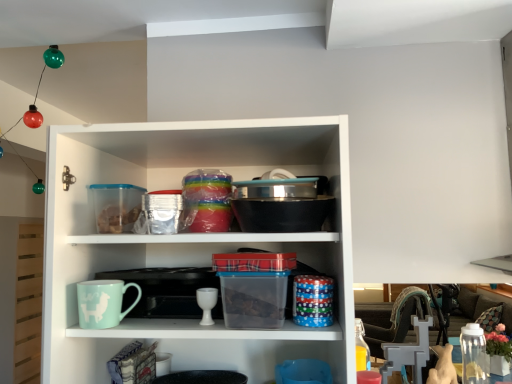
Question: Is the position of light blue ceramic mug at lower left less distant than that of clear plastic jar at lower right?

Choices:
 (A) yes
 (B) no

Answer: (A)

Question: Considering the relative sizes of light blue ceramic mug at lower left and clear plastic jar at lower right in the image provided, is light blue ceramic mug at lower left shorter than clear plastic jar at lower right?

Choices:
 (A) yes
 (B) no

Answer: (A)

Question: Is light blue ceramic mug at lower left at the left side of clear plastic jar at lower right?

Choices:
 (A) no
 (B) yes

Answer: (B)

Question: Considering the relative sizes of light blue ceramic mug at lower left and clear plastic jar at lower right in the image provided, is light blue ceramic mug at lower left wider than clear plastic jar at lower right?

Choices:
 (A) no
 (B) yes

Answer: (A)

Question: Would you consider light blue ceramic mug at lower left to be distant from clear plastic jar at lower right?

Choices:
 (A) no
 (B) yes

Answer: (B)

Question: Can you confirm if light blue ceramic mug at lower left is bigger than clear plastic jar at lower right?

Choices:
 (A) yes
 (B) no

Answer: (B)

Question: Is white glossy goblet at center positioned beyond the bounds of light blue ceramic mug at lower left?

Choices:
 (A) no
 (B) yes

Answer: (B)

Question: From a real-world perspective, is white glossy goblet at center physically above light blue ceramic mug at lower left?

Choices:
 (A) no
 (B) yes

Answer: (A)

Question: From the image's perspective, is white glossy goblet at center below light blue ceramic mug at lower left?

Choices:
 (A) yes
 (B) no

Answer: (A)

Question: Is white glossy goblet at center turned away from light blue ceramic mug at lower left?

Choices:
 (A) no
 (B) yes

Answer: (A)

Question: Could you tell me if white glossy goblet at center is turned towards light blue ceramic mug at lower left?

Choices:
 (A) no
 (B) yes

Answer: (A)

Question: Could light blue ceramic mug at lower left be considered to be inside white glossy goblet at center?

Choices:
 (A) yes
 (B) no

Answer: (B)

Question: Would you say light blue ceramic mug at lower left contains white glossy goblet at center?

Choices:
 (A) yes
 (B) no

Answer: (B)